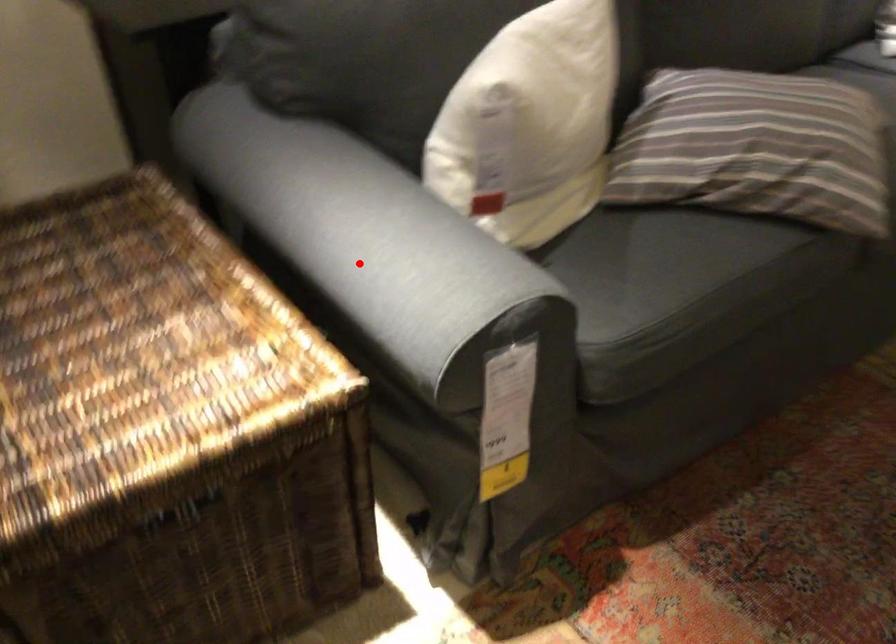
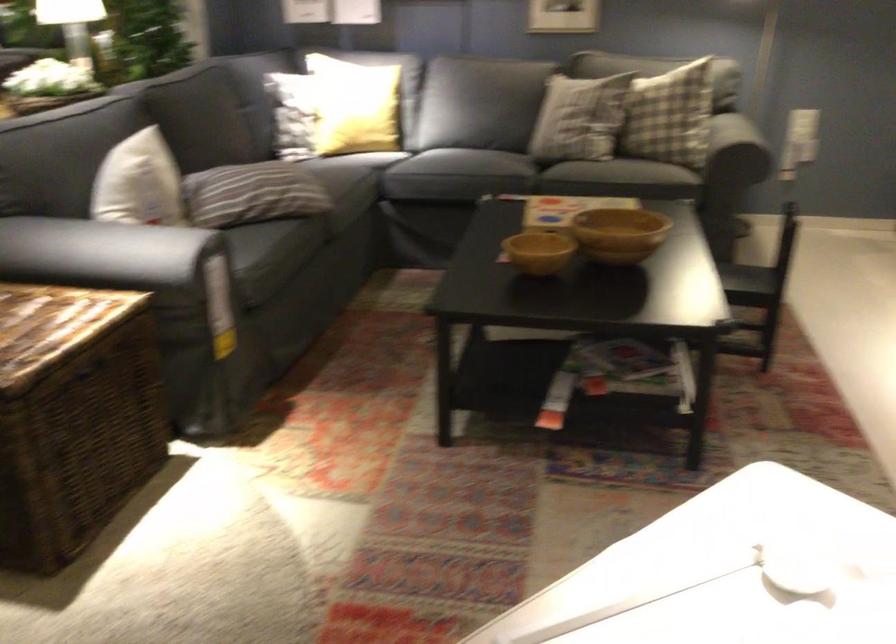
Question: I am providing you with two images of the same scene from different viewpoints. Given a red point in image1, look at the same physical point in image2. Is it:

Choices:
 (A) Closer to the viewpoint
 (B) Farther from the viewpoint

Answer: (B)